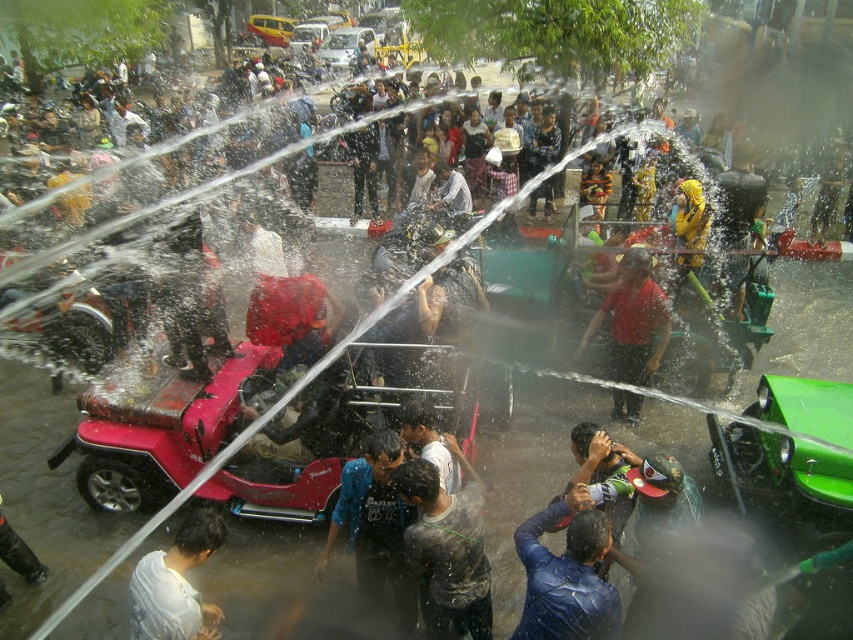
Is wet skin at center positioned before dark blue leather jacket at lower center?

No, it is not.

Which of these two, wet skin at center or dark blue leather jacket at lower center, stands shorter?

dark blue leather jacket at lower center

Who is more forward, (395, 476) or (573, 508)?

Point (573, 508) is in front.

The height and width of the screenshot is (640, 853). I want to click on wet skin at center, so click(x=445, y=550).

Does blue fabric shirt at center appear under white matte shirt at lower left?

No, blue fabric shirt at center is not below white matte shirt at lower left.

Which is in front, point (368, 586) or point (144, 582)?

Positioned in front is point (144, 582).

The width and height of the screenshot is (853, 640). What are the coordinates of `blue fabric shirt at center` in the screenshot? It's located at (375, 528).

Identify the location of blue fabric shirt at center. (375, 528).

Measure the distance between wet skin at center and camera.

A distance of 4.28 meters exists between wet skin at center and camera.

Does point (489, 586) lie in front of point (1, 532)?

Yes, it is.

Does point (434, 563) come behind point (7, 524)?

No, (434, 563) is closer to viewer.

In order to click on wet skin at center in this screenshot , I will do `click(445, 550)`.